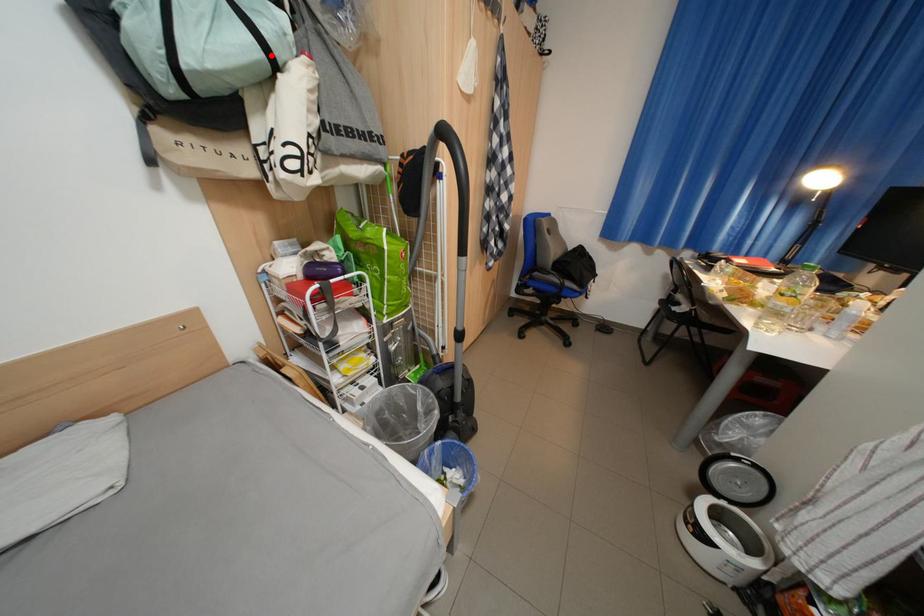
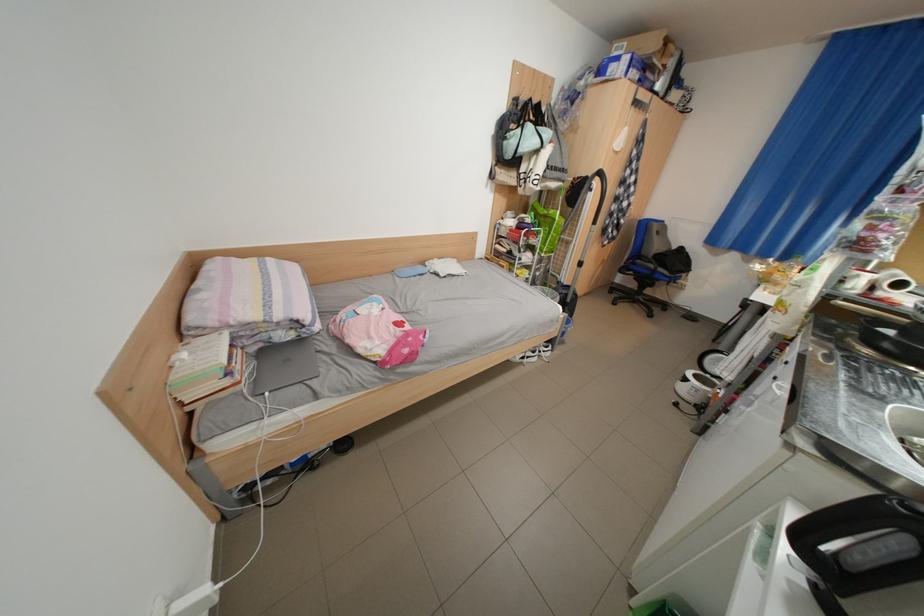
The point at the highlighted location is marked in the first image. Where is the corresponding point in the second image?

(552, 147)